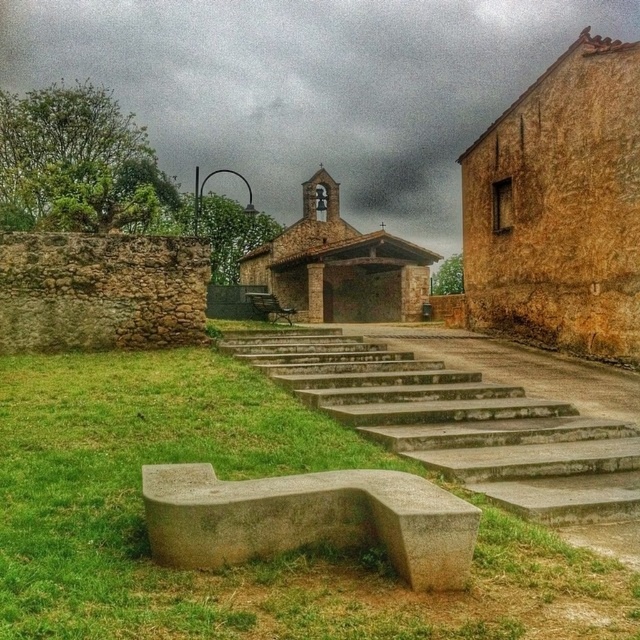
Can you confirm if green grass at lower left is shorter than concrete stairs at center?

No.

Is green grass at lower left to the left of concrete stairs at center from the viewer's perspective?

Yes, green grass at lower left is to the left of concrete stairs at center.

Which is in front, point (452, 636) or point (371, 394)?

Point (452, 636)

Where is `green grass at lower left`? green grass at lower left is located at coordinates (236, 477).

Locate an element on the screen. green grass at lower left is located at coordinates (236, 477).

Is concrete stairs at center taller than gray concrete bench at lower left?

No, concrete stairs at center is not taller than gray concrete bench at lower left.

Which is in front, point (538, 401) or point (177, 474)?

Positioned in front is point (177, 474).

Measure the distance between point [364,356] and camera.

Point [364,356] is 12.99 meters away from camera.

I want to click on concrete stairs at center, so click(458, 422).